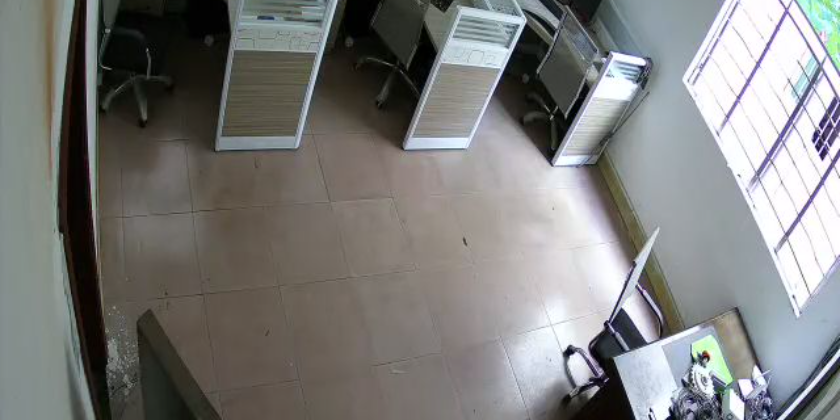
Locate an element on the screen. The width and height of the screenshot is (840, 420). door is located at coordinates (168, 403).